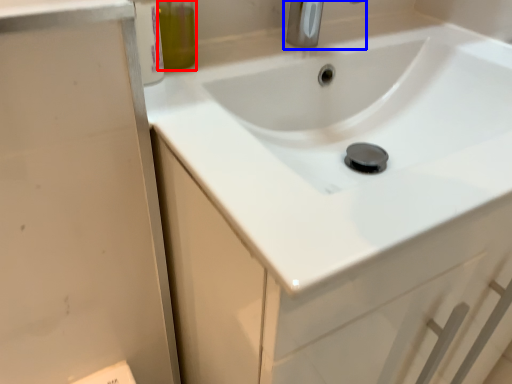
Question: Which object is further to the camera taking this photo, olive oil (highlighted by a red box) or tap (highlighted by a blue box)?

Choices:
 (A) olive oil
 (B) tap

Answer: (B)